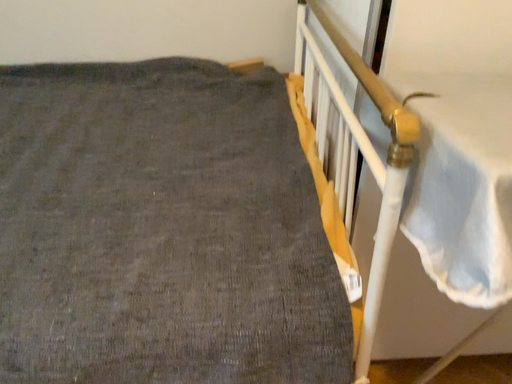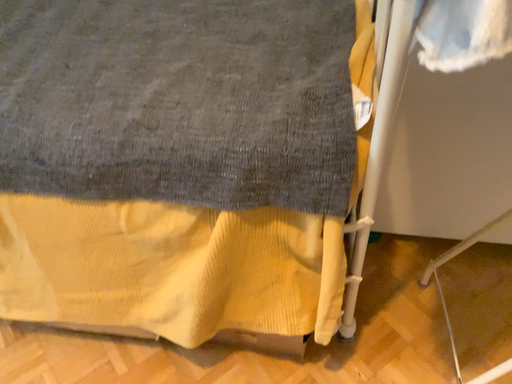
Question: Which way did the camera rotate in the video?

Choices:
 (A) rotated right
 (B) rotated left

Answer: (B)